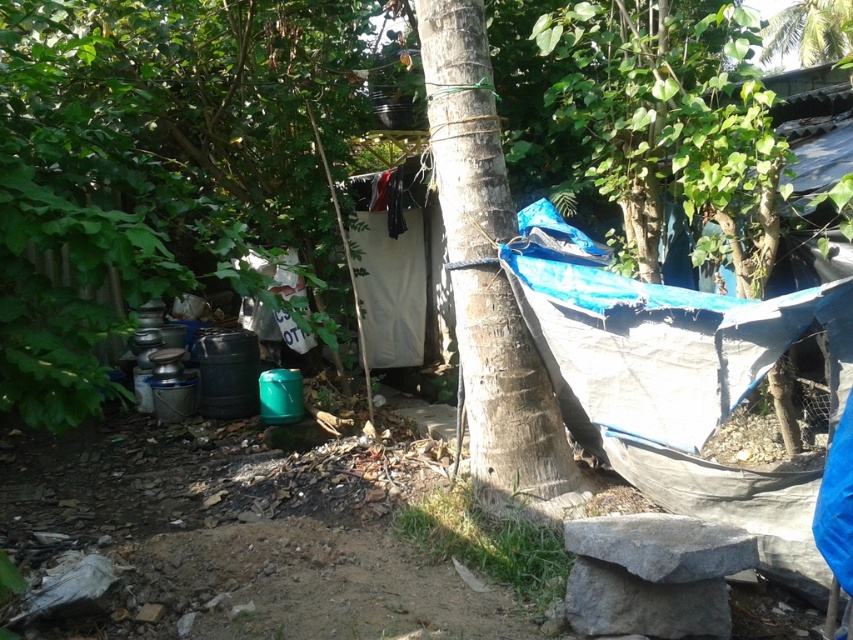
You are standing in the rustic outdoor setting and want to place a small potted plant between the two points, point (627, 369) and point (799, 49). Which point should the plant be closer to in order to be nearer to the viewer?

The plant should be closer to point (627, 369) because it is nearer to the viewer than point (799, 49).

You are setting up a temporary structure in this outdoor area and need to choose between the blue tarp at center and the white fabric at center for a canopy. Based on their sizes, which one would provide more vertical coverage?

The blue tarp at center is much taller than the white fabric at center, so it would provide more vertical coverage for the canopy.